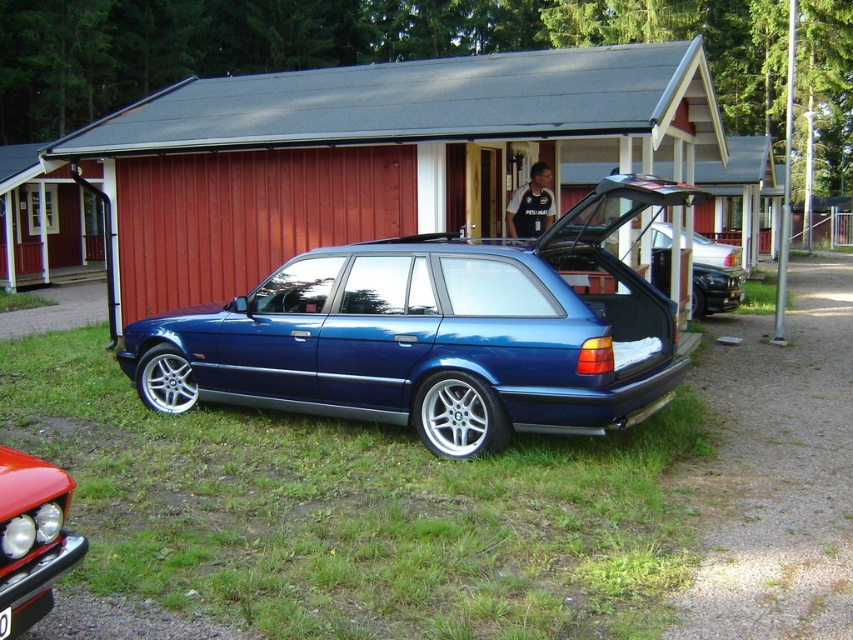
Question: Among these objects, which one is farthest from the camera?

Choices:
 (A) wooden hut at center
 (B) shiny red bumper at lower left
 (C) dark blue jersey at center
 (D) metallic blue wagon at center

Answer: (C)

Question: Is shiny red bumper at lower left wider than black plastic license plate at center?

Choices:
 (A) yes
 (B) no

Answer: (A)

Question: Is the position of wooden door at center more distant than that of black plastic license plate at center?

Choices:
 (A) no
 (B) yes

Answer: (B)

Question: Is wooden hut at center bigger than shiny red bumper at lower left?

Choices:
 (A) no
 (B) yes

Answer: (B)

Question: Which of the following is the farthest from the observer?

Choices:
 (A) wooden door at center
 (B) wooden hut at center
 (C) shiny red bumper at lower left
 (D) metallic blue wagon at center

Answer: (A)

Question: Which of the following is the closest to the observer?

Choices:
 (A) metallic blue wagon at center
 (B) wooden door at center
 (C) shiny red bumper at lower left

Answer: (C)